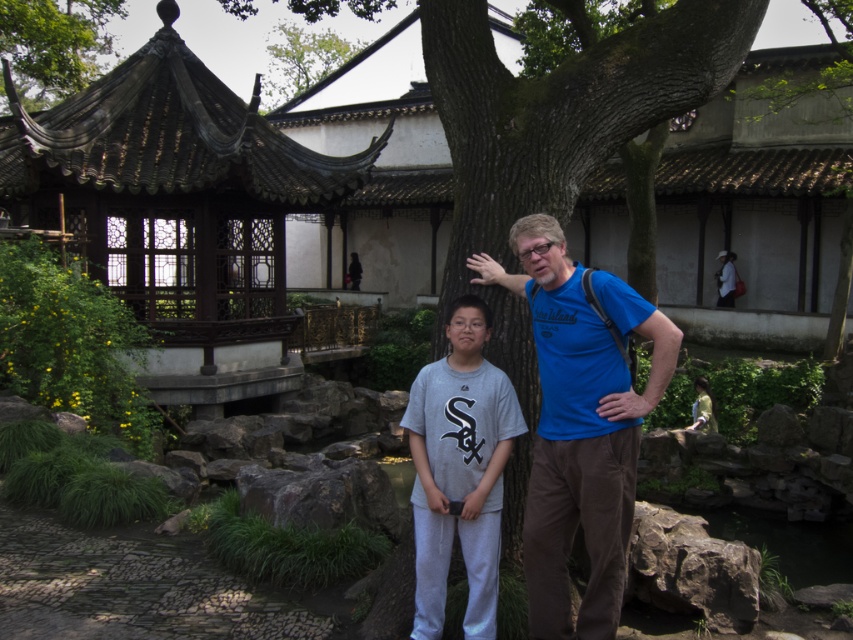
Question: Does gray sweatpants at center appear under smooth brown tree trunk at upper left?

Choices:
 (A) no
 (B) yes

Answer: (B)

Question: Among these points, which one is nearest to the camera?

Choices:
 (A) (637, 408)
 (B) (67, 58)
 (C) (287, 67)

Answer: (A)

Question: Is dark brown wood gazebo at upper left above smooth brown tree trunk at upper left?

Choices:
 (A) no
 (B) yes

Answer: (A)

Question: Does blue cotton shirt at center have a lesser width compared to green leafy tree at upper center?

Choices:
 (A) yes
 (B) no

Answer: (A)

Question: Which point appears closest to the camera in this image?

Choices:
 (A) (345, 54)
 (B) (569, 509)
 (C) (61, 99)

Answer: (B)

Question: Which object is closer to the camera taking this photo?

Choices:
 (A) gray sweatpants at center
 (B) blue cotton shirt at center

Answer: (B)